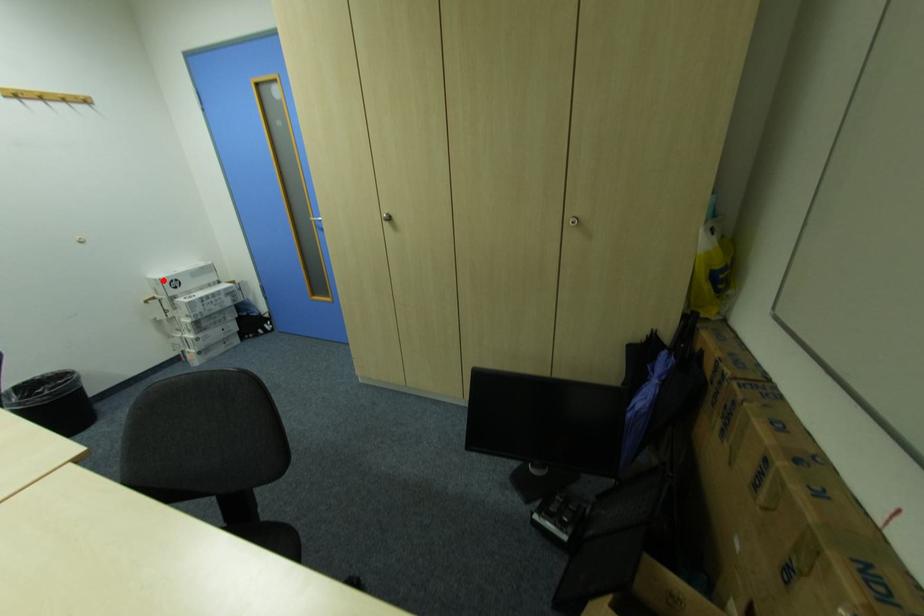
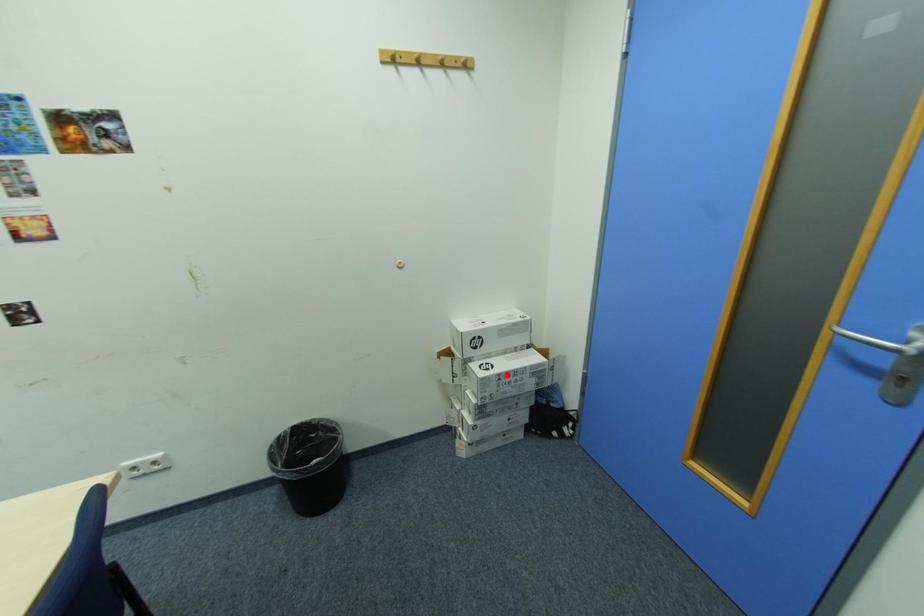
I am providing you with two images of the same scene from different viewpoints. A red point is marked on the first image and another point is marked on the second image. Are the points marked in image1 and image2 representing the same 3D position?

No